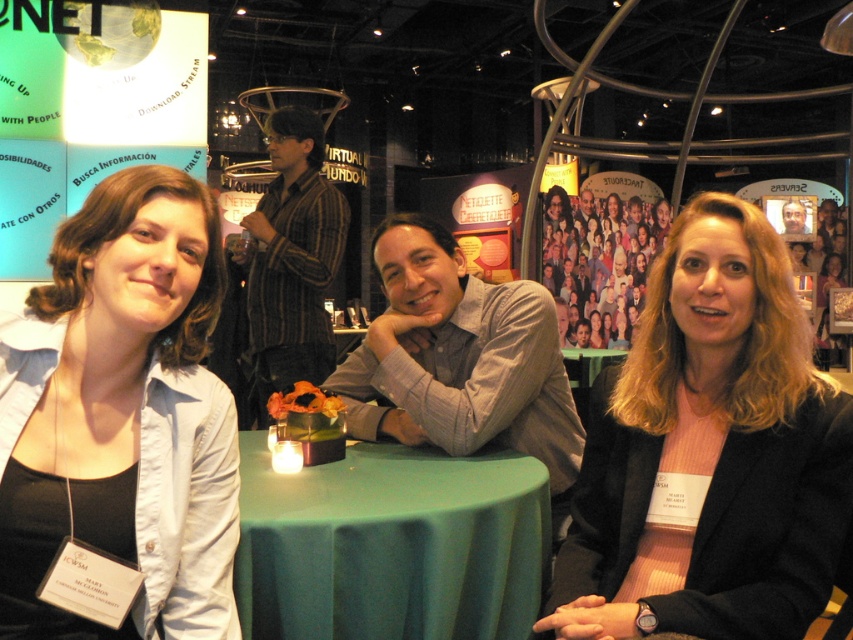
Question: Which of the following is the closest to the observer?

Choices:
 (A) (503, 452)
 (B) (537, 296)
 (C) (824, 214)
 (D) (792, 234)

Answer: (A)

Question: In this image, where is gray cotton shirt at center located relative to striped shirt at center?

Choices:
 (A) left
 (B) right

Answer: (B)

Question: Observing the image, what is the correct spatial positioning of matte blue shirt at center in reference to striped shirt at center?

Choices:
 (A) below
 (B) above

Answer: (A)

Question: Which object is farther from the camera taking this photo?

Choices:
 (A) green fabric tablecloth at center
 (B) striped shirt at center
 (C) matte black shirt at center
 (D) gray cotton shirt at center

Answer: (C)

Question: Estimate the real-world distances between objects in this image. Which object is closer to the green fabric tablecloth at center?

Choices:
 (A) matte black shirt at center
 (B) gray cotton shirt at center
 (C) blonde hair at center

Answer: (B)

Question: Can you confirm if green fabric tablecloth at center is positioned to the right of brown leather jacket at center?

Choices:
 (A) yes
 (B) no

Answer: (B)